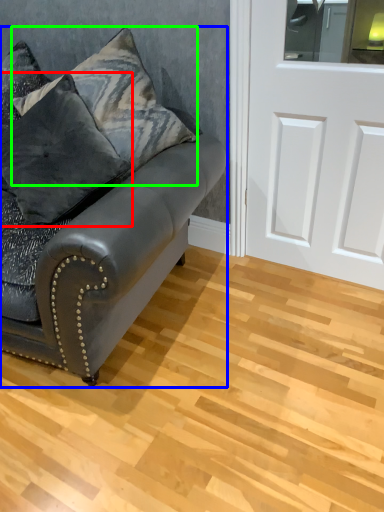
Question: Which is farther away from pillow (highlighted by a red box)? studio couch (highlighted by a blue box) or pillow (highlighted by a green box)?

Choices:
 (A) studio couch
 (B) pillow

Answer: (A)